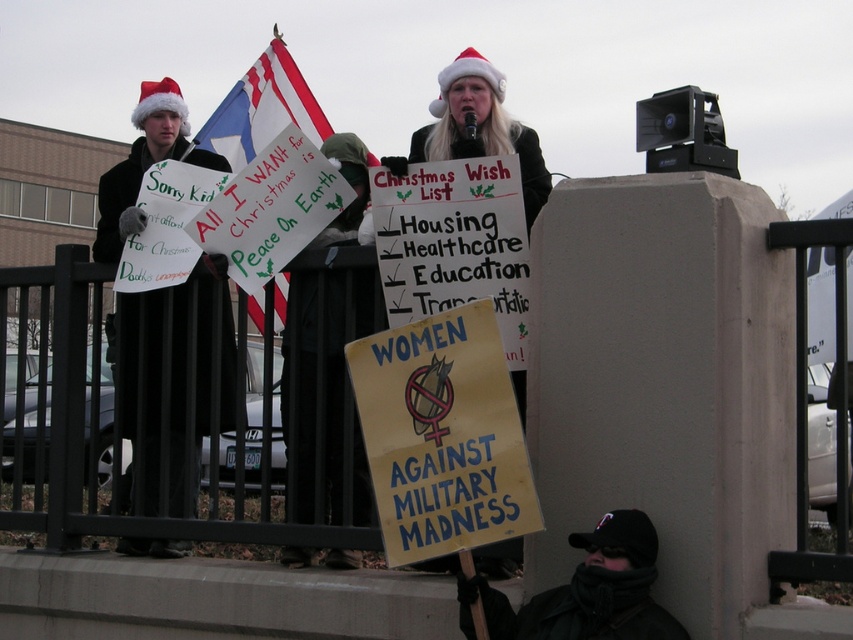
Can you confirm if black fabric cape at center is taller than black woolen hat at lower right?

Correct, black fabric cape at center is much taller as black woolen hat at lower right.

Can you confirm if black fabric cape at center is positioned above black woolen hat at lower right?

Yes, black fabric cape at center is above black woolen hat at lower right.

Does point (305, 452) come behind point (469, 580)?

Yes, it is behind point (469, 580).

The height and width of the screenshot is (640, 853). Identify the location of black fabric cape at center. (305, 397).

Is point (361, 148) closer to viewer compared to point (53, 468)?

Yes, it is in front of point (53, 468).

Is point (300, 547) farther from viewer compared to point (221, 534)?

No, it is not.

Identify the location of black fabric cape at center. The height and width of the screenshot is (640, 853). (305, 397).

Is point (108, 236) closer to viewer compared to point (340, 140)?

That is False.

Who is more forward, (120, 364) or (332, 467)?

Positioned in front is point (332, 467).

You are a GUI agent. You are given a task and a screenshot of the screen. Output one action in this format:
    pyautogui.click(x=<x>, y=<y>)
    Task: Click on the black fabric santa hat at left
    
    Given the screenshot: What is the action you would take?
    pyautogui.click(x=138, y=164)